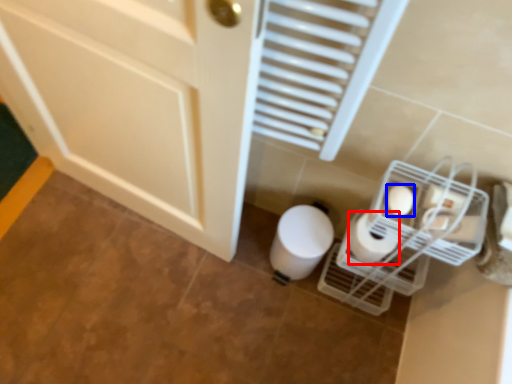
Question: Which object appears closest to the camera in this image, toilet paper (highlighted by a red box) or toilet paper (highlighted by a blue box)?

Choices:
 (A) toilet paper
 (B) toilet paper

Answer: (B)